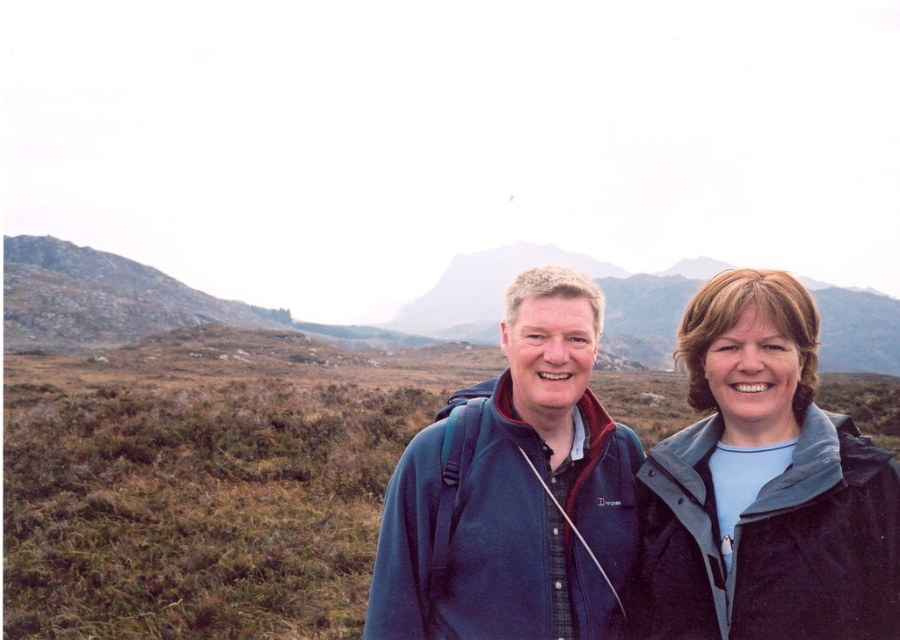
Question: Is blue fabric jacket at right wider than blue fleece jacket at center?

Choices:
 (A) no
 (B) yes

Answer: (A)

Question: Is blue fabric jacket at right smaller than blue fleece jacket at center?

Choices:
 (A) no
 (B) yes

Answer: (B)

Question: Is blue fabric jacket at right wider than blue fleece jacket at center?

Choices:
 (A) no
 (B) yes

Answer: (A)

Question: Among these objects, which one is farthest from the camera?

Choices:
 (A) blue fabric jacket at right
 (B) blue fleece jacket at center

Answer: (B)